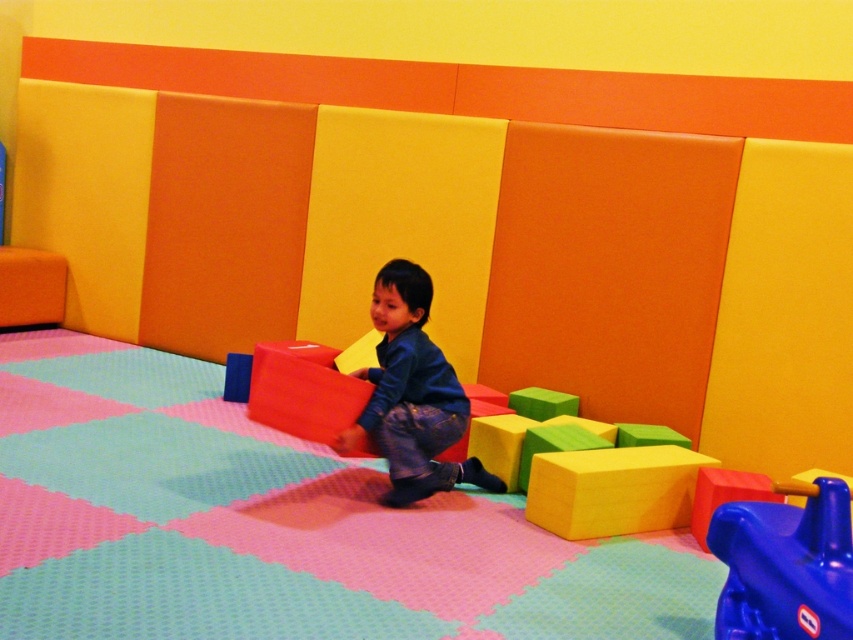
Question: Is dark blue denim pants at center smaller than yellow foam cube at center?

Choices:
 (A) yes
 (B) no

Answer: (B)

Question: Does blue plastic toy at lower right appear on the left side of yellow foam cube at center?

Choices:
 (A) yes
 (B) no

Answer: (B)

Question: Does blue plastic toy at lower right have a larger size compared to dark blue denim pants at center?

Choices:
 (A) yes
 (B) no

Answer: (B)

Question: Which point appears farthest from the camera in this image?

Choices:
 (A) (676, 467)
 (B) (824, 621)

Answer: (A)

Question: Which of the following is the farthest from the observer?

Choices:
 (A) dark blue denim pants at center
 (B) yellow foam cube at center
 (C) blue plastic toy at lower right

Answer: (B)

Question: Which object is farther from the camera taking this photo?

Choices:
 (A) dark blue denim pants at center
 (B) yellow foam cube at center

Answer: (B)